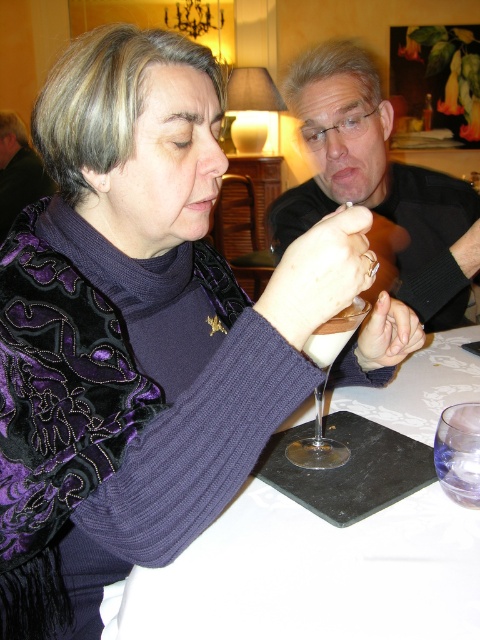
You are taking a photo of two points in the image. The first point is labeled as point [372,170] and the second is point [6,154]. Which point will appear larger in your photo?

Point [372,170] will appear larger in the photo because it is closer to the camera than point [6,154].

You are a photographer trying to capture a candid shot of the scene. You notice the matte black shirt at upper right and the transparent glass at center. Which object should you focus on if you want to highlight something closer to the camera?

The transparent glass at center is closer to the camera than the matte black shirt at upper right because objects that are much taller in the frame appear closer. Since the matte black shirt at upper right is much taller as the transparent glass at center, the glass must be closer.